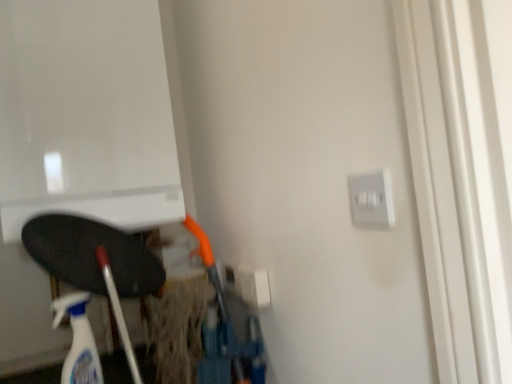
Question: Is satin silver switch at upper right, the second electric outlet from the left, completely or partially outside of translucent plastic spray bottle at lower left?

Choices:
 (A) no
 (B) yes

Answer: (B)

Question: From a real-world perspective, is satin silver switch at upper right, the first electric outlet when ordered from front to back, physically above translucent plastic spray bottle at lower left?

Choices:
 (A) no
 (B) yes

Answer: (B)

Question: Does satin silver switch at upper right, placed as the second electric outlet when sorted from back to front, appear on the left side of translucent plastic spray bottle at lower left?

Choices:
 (A) yes
 (B) no

Answer: (B)

Question: Can you confirm if satin silver switch at upper right, the 1th electric outlet when ordered from right to left, is positioned to the right of translucent plastic spray bottle at lower left?

Choices:
 (A) yes
 (B) no

Answer: (A)

Question: From a real-world perspective, is satin silver switch at upper right, which appears as the 1th electric outlet when viewed from the top, positioned under translucent plastic spray bottle at lower left based on gravity?

Choices:
 (A) yes
 (B) no

Answer: (B)

Question: Are satin silver switch at upper right, the first electric outlet when ordered from front to back, and translucent plastic spray bottle at lower left far apart?

Choices:
 (A) yes
 (B) no

Answer: (B)

Question: Is white plastic electric outlet at center-right, arranged as the second electric outlet when viewed from the right, with translucent plastic spray bottle at lower left?

Choices:
 (A) yes
 (B) no

Answer: (B)

Question: Is white plastic electric outlet at center-right, positioned as the 1th electric outlet in back-to-front order, facing away from translucent plastic spray bottle at lower left?

Choices:
 (A) yes
 (B) no

Answer: (B)

Question: From the image's perspective, is white plastic electric outlet at center-right, which ranks as the 2th electric outlet in front-to-back order, located beneath translucent plastic spray bottle at lower left?

Choices:
 (A) yes
 (B) no

Answer: (B)

Question: Considering the relative positions of white plastic electric outlet at center-right, arranged as the first electric outlet when viewed from the left, and translucent plastic spray bottle at lower left in the image provided, is white plastic electric outlet at center-right, arranged as the first electric outlet when viewed from the left, behind translucent plastic spray bottle at lower left?

Choices:
 (A) yes
 (B) no

Answer: (A)

Question: From a real-world perspective, is white plastic electric outlet at center-right, which ranks as the first electric outlet in bottom-to-top order, positioned under translucent plastic spray bottle at lower left based on gravity?

Choices:
 (A) no
 (B) yes

Answer: (A)

Question: Would you say translucent plastic spray bottle at lower left is part of white plastic electric outlet at center-right, positioned as the 1th electric outlet in back-to-front order,'s contents?

Choices:
 (A) no
 (B) yes

Answer: (A)

Question: Is translucent plastic spray bottle at lower left far away from white plastic electric outlet at center-right, arranged as the first electric outlet when viewed from the left?

Choices:
 (A) yes
 (B) no

Answer: (B)